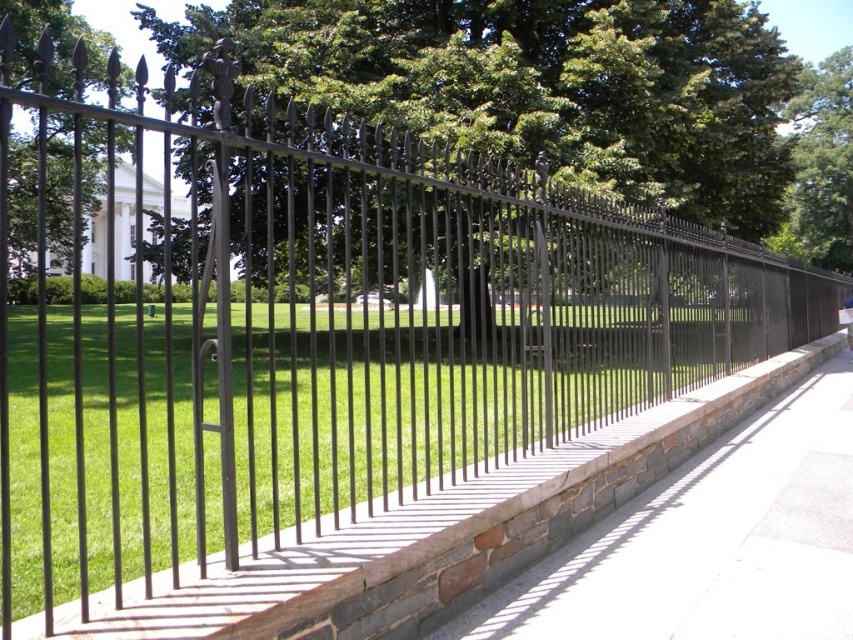
Which is more to the right, gray concrete pavement at center or green leafy tree at upper right?

From the viewer's perspective, green leafy tree at upper right appears more on the right side.

Which is more to the left, gray concrete pavement at center or green leafy tree at upper right?

Positioned to the left is gray concrete pavement at center.

Where is `gray concrete pavement at center`? This screenshot has height=640, width=853. gray concrete pavement at center is located at coordinates (709, 541).

Is green leafy tree at center smaller than green leafy tree at upper right?

Yes.

Can you confirm if green leafy tree at center is positioned above green leafy tree at upper right?

Incorrect, green leafy tree at center is not positioned above green leafy tree at upper right.

Identify the location of green leafy tree at center. This screenshot has width=853, height=640. (541, 84).

Does green leafy tree at center have a greater height compared to gray concrete pavement at center?

Yes.

Who is more forward, (399, 104) or (787, 432)?

Positioned in front is point (787, 432).

What do you see at coordinates (541, 84) in the screenshot? I see `green leafy tree at center` at bounding box center [541, 84].

The width and height of the screenshot is (853, 640). Find the location of `green leafy tree at center`. green leafy tree at center is located at coordinates click(x=541, y=84).